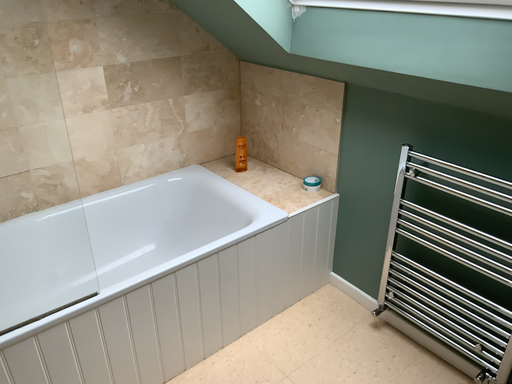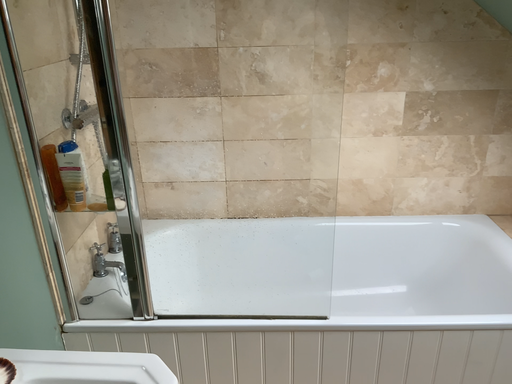
Question: How did the camera likely rotate when shooting the video?

Choices:
 (A) rotated left
 (B) rotated right

Answer: (A)